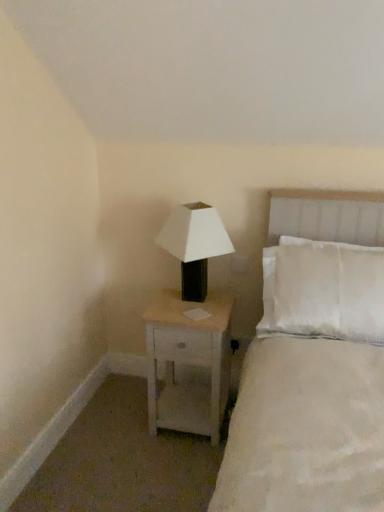
This screenshot has width=384, height=512. Identify the location of free area below white matte/black plastic lamp at upper right (from a real-world perspective). (196, 303).